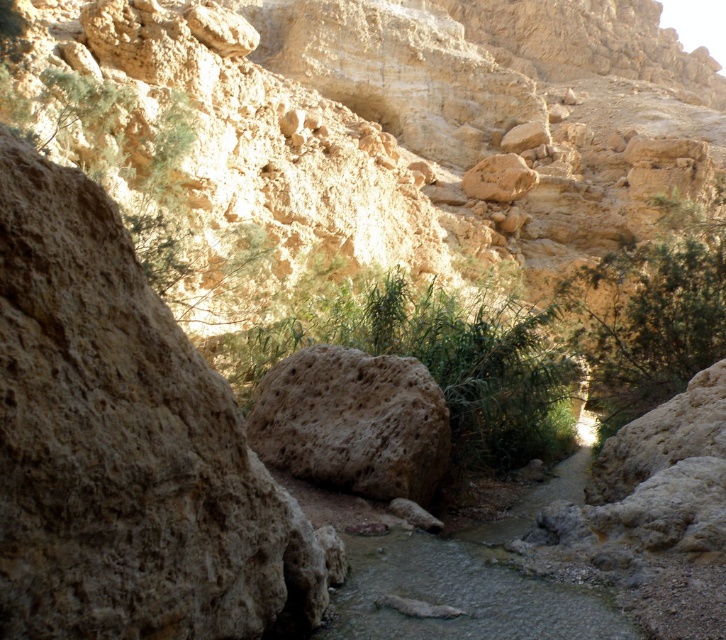
Question: Which of the following is the closest to the observer?

Choices:
 (A) green leafy bush at center
 (B) brown porous rock at center
 (C) brown rough rock at left

Answer: (C)

Question: Can you confirm if green leafy bush at center is positioned below green leafy bush at upper right?

Choices:
 (A) no
 (B) yes

Answer: (B)

Question: Is green leafy bush at center to the left of brown porous rock at center from the viewer's perspective?

Choices:
 (A) yes
 (B) no

Answer: (B)

Question: Which of the following is the closest to the observer?

Choices:
 (A) [x=363, y=476]
 (B) [x=154, y=492]

Answer: (B)

Question: Estimate the real-world distances between objects in this image. Which object is farther from the brown porous rock at center?

Choices:
 (A) green leafy bush at center
 (B) brown rough rock at left

Answer: (B)

Question: From the image, what is the correct spatial relationship of green leafy bush at upper right in relation to brown porous rock at center?

Choices:
 (A) left
 (B) right

Answer: (B)